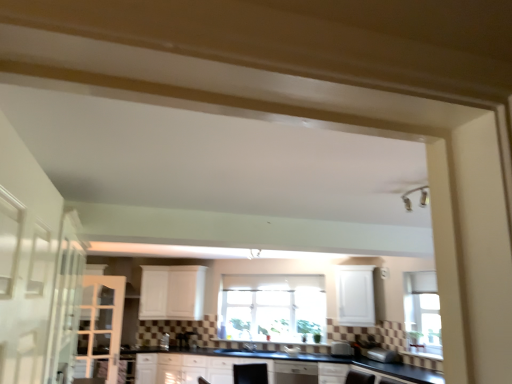
I want to click on white matte cabinet at center, the first cabinetry in the back-to-front sequence, so click(172, 292).

Identify the location of black glossy sink at center. The image size is (512, 384). (246, 347).

Where is `white glass screen door at left`? white glass screen door at left is located at coordinates (100, 325).

From a real-world perspective, is satin silver toaster at lower center, the 1th appliance when ordered from front to back, positioned under clear glass window at center based on gravity?

Correct, in the physical world, satin silver toaster at lower center, the 1th appliance when ordered from front to back, is lower than clear glass window at center.

Is satin silver toaster at lower center, which appears as the 1th appliance when viewed from the right, positioned before clear glass window at center?

Yes, it is.

Is satin silver toaster at lower center, the 2th appliance positioned from the back, next to clear glass window at center and touching it?

No, satin silver toaster at lower center, the 2th appliance positioned from the back, is not making contact with clear glass window at center.

From a real-world perspective, which appliance is the 2nd one underneath the clear glass window at center? Please provide its 2D coordinates.

[(384, 356)]

Considering the sizes of objects satin silver toaster at lower center, which ranks as the second appliance in right-to-left order, and satin silver toaster at lower center, the 2th appliance positioned from the back, in the image provided, who is bigger, satin silver toaster at lower center, which ranks as the second appliance in right-to-left order, or satin silver toaster at lower center, the 2th appliance positioned from the back,?

Bigger between the two is satin silver toaster at lower center, the 2th appliance positioned from the back.

Between satin silver toaster at lower center, the first appliance in the back-to-front sequence, and satin silver toaster at lower center, the 2th appliance positioned from the back, which one appears on the right side from the viewer's perspective?

Positioned to the right is satin silver toaster at lower center, the 2th appliance positioned from the back.

Considering the relative sizes of satin silver toaster at lower center, the 1th appliance when ordered from left to right, and satin silver toaster at lower center, the 2th appliance positioned from the back, in the image provided, is satin silver toaster at lower center, the 1th appliance when ordered from left to right, shorter than satin silver toaster at lower center, the 2th appliance positioned from the back,?

In fact, satin silver toaster at lower center, the 1th appliance when ordered from left to right, may be taller than satin silver toaster at lower center, the 2th appliance positioned from the back.

Is white matte cabinet at center, the first cabinetry in the back-to-front sequence, not near clear glass window at center?

They are positioned close to each other.

Looking at their sizes, would you say white matte cabinet at center, arranged as the 2th cabinetry when viewed from the front, is wider or thinner than clear glass window at center?

In the image, white matte cabinet at center, arranged as the 2th cabinetry when viewed from the front, appears to be wider than clear glass window at center.

From the image's perspective, would you say white matte cabinet at center, which is the 2th cabinetry in right-to-left order, is positioned over clear glass window at center?

Indeed, from the image's perspective, white matte cabinet at center, which is the 2th cabinetry in right-to-left order, is shown above clear glass window at center.

I want to click on window located on the right of white matte cabinet at center, which is the 2th cabinetry in right-to-left order, so click(272, 308).

Find the location of a particular element. This screenshot has width=512, height=384. window on the left of white matte cabinet at center, which appears as the 1th cabinetry when viewed from the front is located at coordinates (272, 308).

Looking at this image, in terms of width, does clear glass window at center look wider or thinner when compared to white matte cabinet at center, which appears as the 1th cabinetry when viewed from the front?

clear glass window at center is thinner than white matte cabinet at center, which appears as the 1th cabinetry when viewed from the front.

Which object is further away from the camera taking this photo, clear glass window at center or white matte cabinet at center, which is the second cabinetry in back-to-front order?

clear glass window at center.

Can you confirm if white matte cabinet at center, the 1th cabinetry in the left-to-right sequence, is shorter than black glossy sink at center?

In fact, white matte cabinet at center, the 1th cabinetry in the left-to-right sequence, may be taller than black glossy sink at center.

Could you tell me if white matte cabinet at center, arranged as the 2th cabinetry when viewed from the front, is facing black glossy sink at center?

No, white matte cabinet at center, arranged as the 2th cabinetry when viewed from the front, does not turn towards black glossy sink at center.

Identify the location of sink below the white matte cabinet at center, which is the 2th cabinetry in right-to-left order (from a real-world perspective). This screenshot has height=384, width=512. (246, 347).

Which of these two, satin silver toaster at lower center, arranged as the second appliance when viewed from the front, or white matte cabinet at center, the first cabinetry in the right-to-left sequence, is thinner?

Thinner between the two is satin silver toaster at lower center, arranged as the second appliance when viewed from the front.

From a real-world perspective, which is physically above, satin silver toaster at lower center, the 1th appliance when ordered from left to right, or white matte cabinet at center, which appears as the 1th cabinetry when viewed from the front?

white matte cabinet at center, which appears as the 1th cabinetry when viewed from the front, is physically above.

Between point (340, 341) and point (366, 326), which one is positioned behind?

The point (366, 326) is farther from the camera.

Is satin silver toaster at lower center, the first appliance in the back-to-front sequence, positioned beyond the bounds of white matte cabinet at center, the first cabinetry in the right-to-left sequence?

Absolutely, satin silver toaster at lower center, the first appliance in the back-to-front sequence, is external to white matte cabinet at center, the first cabinetry in the right-to-left sequence.

From a real-world perspective, between clear glass window at center and white matte cabinet at center, the first cabinetry in the back-to-front sequence, who is vertically higher?

white matte cabinet at center, the first cabinetry in the back-to-front sequence, from a real-world perspective.

Considering the relative sizes of clear glass window at center and white matte cabinet at center, which is the 2th cabinetry in right-to-left order, in the image provided, is clear glass window at center thinner than white matte cabinet at center, which is the 2th cabinetry in right-to-left order,?

Yes, clear glass window at center is thinner than white matte cabinet at center, which is the 2th cabinetry in right-to-left order.

Where is `the 1st cabinetry in front of the clear glass window at center, starting your count from the anchor`? the 1st cabinetry in front of the clear glass window at center, starting your count from the anchor is located at coordinates (172, 292).

Is point (290, 303) less distant than point (195, 298)?

No.

From a real-world perspective, count 2nd appliances downward from the clear glass window at center and point to it. Please provide its 2D coordinates.

[(384, 356)]

Where is `appliance that is below the satin silver toaster at lower center, the 2th appliance positioned from the back (from the image's perspective)`? Image resolution: width=512 pixels, height=384 pixels. appliance that is below the satin silver toaster at lower center, the 2th appliance positioned from the back (from the image's perspective) is located at coordinates (341, 349).

From the image, which object appears to be nearer to clear glass window at center, black glossy sink at center or white matte cabinet at center, which is the 2th cabinetry in right-to-left order?

Among the two, black glossy sink at center is located nearer to clear glass window at center.

When comparing their distances from satin silver toaster at lower center, the 2th appliance positioned from the back, does black glossy sink at center or white matte cabinet at center, which appears as the 1th cabinetry when viewed from the front, seem further?

black glossy sink at center.

Which object lies further to the anchor point black glossy sink at center, white matte cabinet at center, arranged as the 2th cabinetry when viewed from the front, or white glass screen door at left?

white glass screen door at left lies further to black glossy sink at center than the other object.

Considering their positions, is clear glass window at center positioned further to white matte cabinet at center, acting as the 2th cabinetry starting from the left, than satin silver toaster at lower center, which ranks as the second appliance in right-to-left order?

The object further to white matte cabinet at center, acting as the 2th cabinetry starting from the left, is satin silver toaster at lower center, which ranks as the second appliance in right-to-left order.

Estimate the real-world distances between objects in this image. Which object is further from white matte cabinet at center, which is the second cabinetry in back-to-front order, white glass screen door at left or satin silver toaster at lower center, the 1th appliance when ordered from left to right?

The object further to white matte cabinet at center, which is the second cabinetry in back-to-front order, is white glass screen door at left.

Considering their positions, is black glossy sink at center positioned closer to clear glass window at center than white matte cabinet at center, the first cabinetry in the right-to-left sequence?

black glossy sink at center lies closer to clear glass window at center than the other object.

From the image, which object appears to be farther from black glossy sink at center, white glass screen door at left or white matte cabinet at center, which appears as the 1th cabinetry when viewed from the front?

white glass screen door at left lies further to black glossy sink at center than the other object.

From the image, which object appears to be farther from black glossy sink at center, clear glass window at center or white matte cabinet at center, acting as the 2th cabinetry starting from the left?

white matte cabinet at center, acting as the 2th cabinetry starting from the left, is further to black glossy sink at center.

The height and width of the screenshot is (384, 512). In order to click on sink situated between white glass screen door at left and satin silver toaster at lower center, arranged as the second appliance when viewed from the front, from left to right in this screenshot , I will do `click(246, 347)`.

You are a GUI agent. You are given a task and a screenshot of the screen. Output one action in this format:
    pyautogui.click(x=<x>, y=<y>)
    Task: Click on the sink between white matte cabinet at center, the 1th cabinetry in the left-to-right sequence, and satin silver toaster at lower center, arranged as the second appliance when viewed from the front, from left to right
    The width and height of the screenshot is (512, 384).
    Given the screenshot: What is the action you would take?
    pyautogui.click(x=246, y=347)

This screenshot has height=384, width=512. Identify the location of appliance situated between white matte cabinet at center, the first cabinetry in the back-to-front sequence, and white matte cabinet at center, which appears as the 1th cabinetry when viewed from the front, from left to right. (341, 349).

Where is `window situated between black glossy sink at center and satin silver toaster at lower center, the first appliance in the back-to-front sequence, from left to right`? The height and width of the screenshot is (384, 512). window situated between black glossy sink at center and satin silver toaster at lower center, the first appliance in the back-to-front sequence, from left to right is located at coordinates pos(272,308).